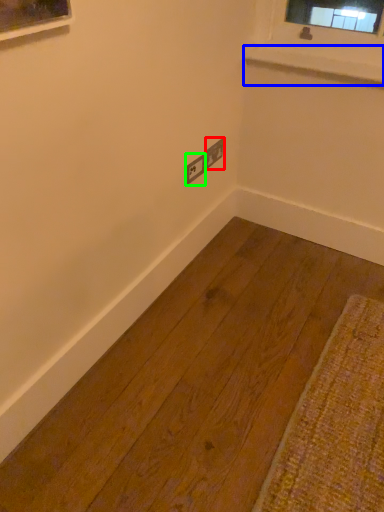
Question: Estimate the real-world distances between objects in this image. Which object is farther from electric outlet (highlighted by a red box), window sill (highlighted by a blue box) or electric outlet (highlighted by a green box)?

Choices:
 (A) window sill
 (B) electric outlet

Answer: (A)